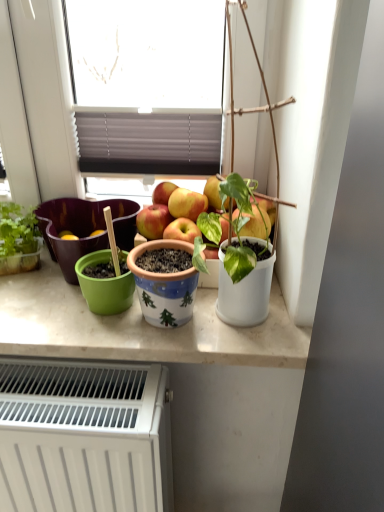
Find the location of `white glossy countertop at center`. white glossy countertop at center is located at coordinates (138, 328).

Measure the distance between point (78,245) and camera.

Point (78,245) and camera are 36.97 inches apart.

Identify the location of green matte flowerpot at left, the 1th flowerpot when ordered from left to right. The image size is (384, 512). (84, 228).

You are a GUI agent. You are given a task and a screenshot of the screen. Output one action in this format:
    pyautogui.click(x=<x>, y=<y>)
    Task: Click on the white glossy countertop at center
    Image resolution: width=384 pixels, height=512 pixels.
    Given the screenshot: What is the action you would take?
    click(x=138, y=328)

Identify the location of flowerpot located on the left of white glossy countertop at center. The image size is (384, 512). (84, 228).

From the image's perspective, between green matte flowerpot at left, the 2th flowerpot positioned from the front, and white glossy countertop at center, which one is located above?

green matte flowerpot at left, the 2th flowerpot positioned from the front, from the image's perspective.

Considering the relative sizes of green matte flowerpot at left, the 1th flowerpot when ordered from left to right, and white glossy countertop at center in the image provided, is green matte flowerpot at left, the 1th flowerpot when ordered from left to right, smaller than white glossy countertop at center?

Correct, green matte flowerpot at left, the 1th flowerpot when ordered from left to right, occupies less space than white glossy countertop at center.

Can you confirm if green matte flowerpot at left, which appears as the first flowerpot when viewed from the back, is positioned to the right of blue ceramic pot at center, which ranks as the first flowerpot in right-to-left order?

Incorrect, green matte flowerpot at left, which appears as the first flowerpot when viewed from the back, is not on the right side of blue ceramic pot at center, which ranks as the first flowerpot in right-to-left order.

Is green matte flowerpot at left, the 2th flowerpot positioned from the front, positioned far away from blue ceramic pot at center, arranged as the 1th flowerpot when viewed from the front?

No, green matte flowerpot at left, the 2th flowerpot positioned from the front, is in close proximity to blue ceramic pot at center, arranged as the 1th flowerpot when viewed from the front.

From a real-world perspective, is green matte flowerpot at left, the 1th flowerpot when ordered from left to right, above or below blue ceramic pot at center, which ranks as the first flowerpot in right-to-left order?

green matte flowerpot at left, the 1th flowerpot when ordered from left to right, is situated lower than blue ceramic pot at center, which ranks as the first flowerpot in right-to-left order, in the real world.

Based on their sizes in the image, would you say green matte flowerpot at left, the 1th flowerpot when ordered from left to right, is bigger or smaller than blue ceramic pot at center, the 2th flowerpot when ordered from back to front?

Considering their sizes, green matte flowerpot at left, the 1th flowerpot when ordered from left to right, takes up more space than blue ceramic pot at center, the 2th flowerpot when ordered from back to front.

Is blue ceramic pot at center, the 2th flowerpot when ordered from back to front, positioned with its back to white matte radiator at lower left?

No, blue ceramic pot at center, the 2th flowerpot when ordered from back to front, is not facing the opposite direction of white matte radiator at lower left.

From a real-world perspective, which object rests below the other?

In real-world perspective, white matte radiator at lower left is lower.

Can you confirm if blue ceramic pot at center, which ranks as the first flowerpot in right-to-left order, is smaller than white matte radiator at lower left?

Indeed, blue ceramic pot at center, which ranks as the first flowerpot in right-to-left order, has a smaller size compared to white matte radiator at lower left.

Is white matte radiator at lower left a part of blue ceramic pot at center, which ranks as the first flowerpot in right-to-left order?

No, blue ceramic pot at center, which ranks as the first flowerpot in right-to-left order, does not contain white matte radiator at lower left.

Which point is more forward, (76, 222) or (7, 360)?

The point (7, 360) is closer to the camera.

From a real-world perspective, which object rests below the other?

From a 3D spatial view, white matte radiator at lower left is below.

Is green matte flowerpot at left, the 2th flowerpot positioned from the front, smaller than white matte radiator at lower left?

Indeed, green matte flowerpot at left, the 2th flowerpot positioned from the front, has a smaller size compared to white matte radiator at lower left.

From the image's perspective, between green matte flowerpot at left, the 2th flowerpot positioned from the front, and white matte radiator at lower left, who is located below?

white matte radiator at lower left is shown below in the image.

Consider the image. Considering the relative sizes of white matte pot at right and blue ceramic pot at center, arranged as the 1th flowerpot when viewed from the front, in the image provided, is white matte pot at right thinner than blue ceramic pot at center, arranged as the 1th flowerpot when viewed from the front,?

No, white matte pot at right is not thinner than blue ceramic pot at center, arranged as the 1th flowerpot when viewed from the front.

Which object is positioned more to the left, white matte pot at right or blue ceramic pot at center, which ranks as the first flowerpot in right-to-left order?

blue ceramic pot at center, which ranks as the first flowerpot in right-to-left order.

Where is `flowerpot that is the 1st one when counting leftward from the white matte pot at right`? flowerpot that is the 1st one when counting leftward from the white matte pot at right is located at coordinates (164, 287).

From the image's perspective, between white matte pot at right and blue ceramic pot at center, which is the second flowerpot in left-to-right order, who is located below?

blue ceramic pot at center, which is the second flowerpot in left-to-right order.

Does white matte radiator at lower left turn towards white glossy countertop at center?

No, white matte radiator at lower left is not facing towards white glossy countertop at center.

Can you confirm if white matte radiator at lower left is shorter than white glossy countertop at center?

No, white matte radiator at lower left is not shorter than white glossy countertop at center.

From a real-world perspective, is white matte radiator at lower left over white glossy countertop at center?

No, from a real-world perspective, white matte radiator at lower left is not on top of white glossy countertop at center.

Between point (59, 405) and point (37, 292), which one is positioned in front?

Positioned in front is point (59, 405).

Between point (9, 416) and point (158, 310), which one is positioned in front?

The point (9, 416) is more forward.

From the image's perspective, between white matte radiator at lower left and blue ceramic pot at center, arranged as the 1th flowerpot when viewed from the front, which one is located above?

blue ceramic pot at center, arranged as the 1th flowerpot when viewed from the front, from the image's perspective.

From a real-world perspective, is white matte radiator at lower left below blue ceramic pot at center, arranged as the 1th flowerpot when viewed from the front?

Indeed, from a real-world perspective, white matte radiator at lower left is positioned beneath blue ceramic pot at center, arranged as the 1th flowerpot when viewed from the front.

Which object is positioned more to the right, white matte radiator at lower left or blue ceramic pot at center, which ranks as the first flowerpot in right-to-left order?

blue ceramic pot at center, which ranks as the first flowerpot in right-to-left order.

From a real-world perspective, count 1st flowerpots upward from the white glossy countertop at center and point to it. Please provide its 2D coordinates.

[(84, 228)]

Locate an element on the screen. The image size is (384, 512). flowerpot above the blue ceramic pot at center, which is the second flowerpot in left-to-right order (from the image's perspective) is located at coordinates coord(84,228).

Which object lies nearer to the anchor point green matte flowerpot at left, which appears as the first flowerpot when viewed from the back, white glossy countertop at center or white matte radiator at lower left?

Among the two, white glossy countertop at center is located nearer to green matte flowerpot at left, which appears as the first flowerpot when viewed from the back.

Considering their positions, is blue ceramic pot at center, which ranks as the first flowerpot in right-to-left order, positioned further to white matte radiator at lower left than white matte pot at right?

white matte pot at right lies further to white matte radiator at lower left than the other object.

Which object lies further to the anchor point white glossy countertop at center, blue ceramic pot at center, which is the second flowerpot in left-to-right order, or green matte flowerpot at left, the 2th flowerpot positioned from the front?

green matte flowerpot at left, the 2th flowerpot positioned from the front, lies further to white glossy countertop at center than the other object.

Looking at the image, which one is located further to white matte pot at right, white matte radiator at lower left or white glossy countertop at center?

The object further to white matte pot at right is white matte radiator at lower left.

Looking at the image, which one is located further to white matte radiator at lower left, blue ceramic pot at center, arranged as the 1th flowerpot when viewed from the front, or green matte flowerpot at left, the 1th flowerpot when ordered from left to right?

green matte flowerpot at left, the 1th flowerpot when ordered from left to right, is positioned further to the anchor white matte radiator at lower left.

Estimate the real-world distances between objects in this image. Which object is further from blue ceramic pot at center, arranged as the 1th flowerpot when viewed from the front, green matte flowerpot at left, the 2th flowerpot positioned from the front, or white matte radiator at lower left?

The object further to blue ceramic pot at center, arranged as the 1th flowerpot when viewed from the front, is white matte radiator at lower left.

When comparing their distances from white glossy countertop at center, does white matte radiator at lower left or green matte flowerpot at left, the 1th flowerpot when ordered from left to right, seem closer?

white matte radiator at lower left lies closer to white glossy countertop at center than the other object.

From the image, which object appears to be farther from white glossy countertop at center, green matte flowerpot at left, the 2th flowerpot positioned from the front, or white matte radiator at lower left?

green matte flowerpot at left, the 2th flowerpot positioned from the front, is positioned further to the anchor white glossy countertop at center.

This screenshot has width=384, height=512. I want to click on flowerpot between green matte flowerpot at left, which appears as the first flowerpot when viewed from the back, and white matte pot at right from left to right, so click(164, 287).

This screenshot has width=384, height=512. I want to click on counter top between blue ceramic pot at center, the 2th flowerpot when ordered from back to front, and white matte radiator at lower left vertically, so click(138, 328).

Find the location of a particular element. flowerpot that lies between green matte flowerpot at left, the 2th flowerpot positioned from the front, and white matte radiator at lower left from top to bottom is located at coordinates (164, 287).

Where is `counter top between green matte flowerpot at left, the 1th flowerpot when ordered from left to right, and blue ceramic pot at center, which ranks as the first flowerpot in right-to-left order, in the horizontal direction`? The image size is (384, 512). counter top between green matte flowerpot at left, the 1th flowerpot when ordered from left to right, and blue ceramic pot at center, which ranks as the first flowerpot in right-to-left order, in the horizontal direction is located at coordinates coord(138,328).